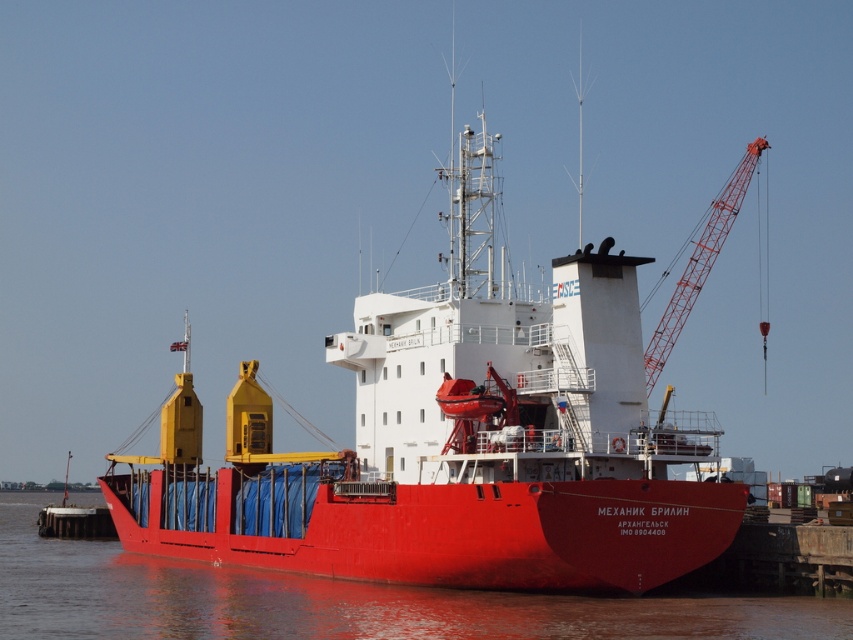
Who is higher up, shiny red ship at center or red metal crane at upper right?

red metal crane at upper right is higher up.

You are a GUI agent. You are given a task and a screenshot of the screen. Output one action in this format:
    pyautogui.click(x=<x>, y=<y>)
    Task: Click on the shiny red ship at center
    
    Given the screenshot: What is the action you would take?
    pyautogui.click(x=456, y=440)

Which is in front, point (483, 454) or point (712, 259)?

Point (483, 454) is in front.

The width and height of the screenshot is (853, 640). What are the coordinates of `shiny red ship at center` in the screenshot? It's located at (456, 440).

The height and width of the screenshot is (640, 853). Find the location of `glossy water at ship center`. glossy water at ship center is located at coordinates (335, 600).

Who is shorter, glossy water at ship center or red metal crane at upper right?

Standing shorter between the two is glossy water at ship center.

Who is more distant from viewer, (508,630) or (738,189)?

Point (738,189)

Identify the location of glossy water at ship center. (335, 600).

Who is higher up, shiny red ship at center or glossy water at ship center?

shiny red ship at center

Is point (215, 552) closer to viewer compared to point (93, 621)?

No, (215, 552) is behind (93, 621).

This screenshot has height=640, width=853. I want to click on shiny red ship at center, so click(x=456, y=440).